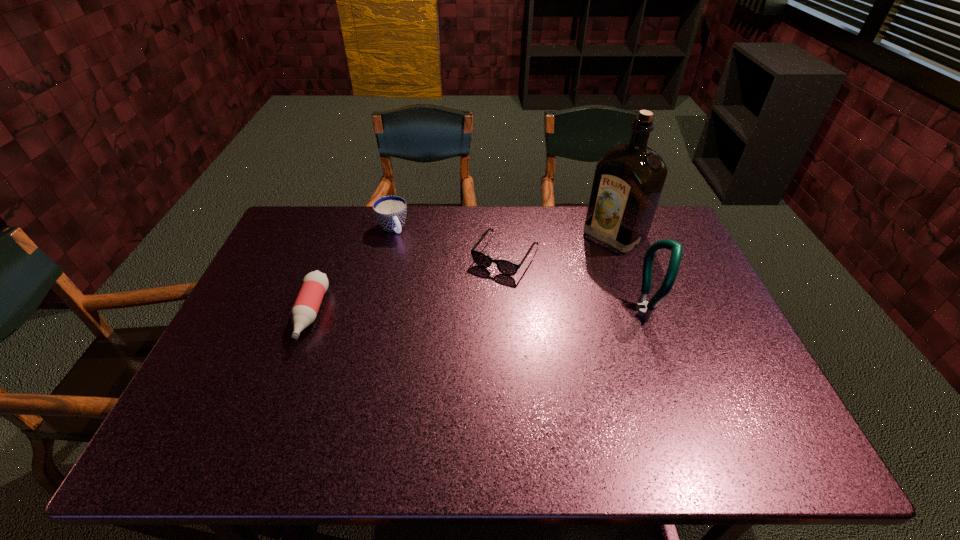
Locate an element on the screen. This screenshot has width=960, height=540. the closest object to the fourth shortest object is located at coordinates (628, 181).

Where is `free space that satisfies the following two spatial constraints: 1. on the front side of the second tallest object; 2. at the jaws of the third shortest object`? This screenshot has width=960, height=540. free space that satisfies the following two spatial constraints: 1. on the front side of the second tallest object; 2. at the jaws of the third shortest object is located at coordinates (372, 312).

Image resolution: width=960 pixels, height=540 pixels. Identify the location of free space that satisfies the following two spatial constraints: 1. on the front side of the third object from right to left; 2. at the jaws of the bottle opener. (509, 312).

The image size is (960, 540). I want to click on vacant space that satisfies the following two spatial constraints: 1. on the front side of the bottle opener; 2. at the jaws of the tallest object, so click(x=643, y=312).

Image resolution: width=960 pixels, height=540 pixels. I want to click on vacant area that satisfies the following two spatial constraints: 1. on the front side of the fourth shortest object; 2. at the jaws of the second object from left to right, so click(372, 312).

Where is `vacant space that satisfies the following two spatial constraints: 1. on the front side of the bottle opener; 2. at the jaws of the fourth object from right to left`? The width and height of the screenshot is (960, 540). vacant space that satisfies the following two spatial constraints: 1. on the front side of the bottle opener; 2. at the jaws of the fourth object from right to left is located at coordinates (372, 312).